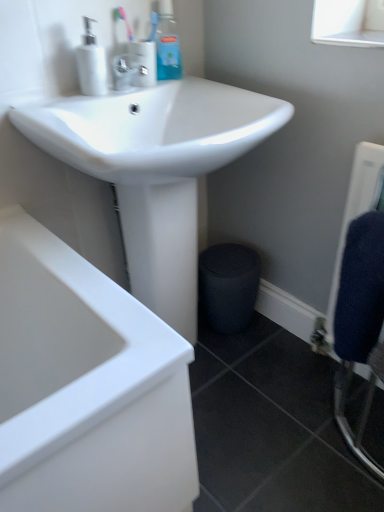
Question: Can you confirm if white glossy sink at upper center is positioned to the left of dark blue textured towel at right?

Choices:
 (A) no
 (B) yes

Answer: (B)

Question: From the image's perspective, is white glossy sink at upper center on dark blue textured towel at right?

Choices:
 (A) no
 (B) yes

Answer: (B)

Question: Does white glossy sink at upper center have a smaller size compared to dark blue textured towel at right?

Choices:
 (A) no
 (B) yes

Answer: (A)

Question: Does white glossy sink at upper center appear on the right side of dark blue textured towel at right?

Choices:
 (A) yes
 (B) no

Answer: (B)

Question: Is dark blue textured towel at right at the back of white glossy sink at upper center?

Choices:
 (A) yes
 (B) no

Answer: (B)

Question: Is blue plastic bottle at upper center, the 1th toiletry in the right-to-left sequence, taller or shorter than white glossy sink at upper center?

Choices:
 (A) tall
 (B) short

Answer: (B)

Question: Is blue plastic bottle at upper center, the 2th toiletry when ordered from left to right, bigger or smaller than white glossy sink at upper center?

Choices:
 (A) small
 (B) big

Answer: (A)

Question: From a real-world perspective, is blue plastic bottle at upper center, the 1th toiletry in the right-to-left sequence, above or below white glossy sink at upper center?

Choices:
 (A) above
 (B) below

Answer: (A)

Question: Considering their positions, is blue plastic bottle at upper center, the 2th toiletry when ordered from left to right, located in front of or behind white glossy sink at upper center?

Choices:
 (A) front
 (B) behind

Answer: (B)

Question: In the image, is pink plastic toothbrush at upper center positioned in front of or behind dark blue textured towel at right?

Choices:
 (A) behind
 (B) front

Answer: (A)

Question: Would you say pink plastic toothbrush at upper center is to the left or to the right of dark blue textured towel at right in the picture?

Choices:
 (A) right
 (B) left

Answer: (B)

Question: Do you think pink plastic toothbrush at upper center is within dark blue textured towel at right, or outside of it?

Choices:
 (A) outside
 (B) inside

Answer: (A)

Question: From the image's perspective, is pink plastic toothbrush at upper center positioned above or below dark blue textured towel at right?

Choices:
 (A) below
 (B) above

Answer: (B)

Question: Is blue plastic bottle at upper center, the 1th toiletry in the right-to-left sequence, inside or outside of pink plastic toothbrush at upper center?

Choices:
 (A) outside
 (B) inside

Answer: (A)

Question: In terms of width, does blue plastic bottle at upper center, the 1th toiletry in the right-to-left sequence, look wider or thinner when compared to pink plastic toothbrush at upper center?

Choices:
 (A) thin
 (B) wide

Answer: (B)